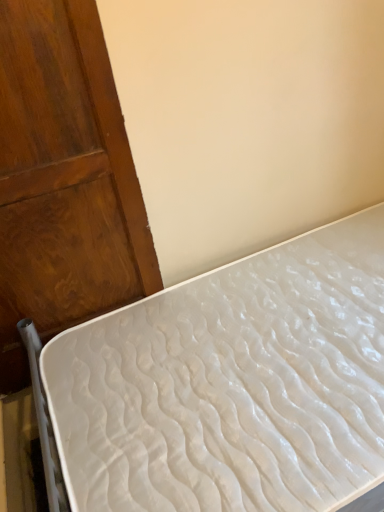
Question: Is wooden door at left wider than white textured mattress at lower right?

Choices:
 (A) no
 (B) yes

Answer: (A)

Question: Is wooden door at left taller than white textured mattress at lower right?

Choices:
 (A) yes
 (B) no

Answer: (A)

Question: From the image's perspective, is wooden door at left located above white textured mattress at lower right?

Choices:
 (A) no
 (B) yes

Answer: (B)

Question: Does wooden door at left touch white textured mattress at lower right?

Choices:
 (A) no
 (B) yes

Answer: (A)

Question: Is the position of wooden door at left less distant than that of white textured mattress at lower right?

Choices:
 (A) yes
 (B) no

Answer: (B)

Question: From a real-world perspective, is wooden door at left positioned over white textured mattress at lower right based on gravity?

Choices:
 (A) no
 (B) yes

Answer: (B)

Question: From a real-world perspective, is white textured mattress at lower right located beneath wooden door at left?

Choices:
 (A) no
 (B) yes

Answer: (B)

Question: Does white textured mattress at lower right have a lesser height compared to wooden door at left?

Choices:
 (A) no
 (B) yes

Answer: (B)

Question: Is white textured mattress at lower right to the left of wooden door at left from the viewer's perspective?

Choices:
 (A) no
 (B) yes

Answer: (A)

Question: Is white textured mattress at lower right closer to the viewer compared to wooden door at left?

Choices:
 (A) yes
 (B) no

Answer: (A)

Question: Is white textured mattress at lower right further to the viewer compared to wooden door at left?

Choices:
 (A) yes
 (B) no

Answer: (B)

Question: From the image's perspective, is white textured mattress at lower right under wooden door at left?

Choices:
 (A) yes
 (B) no

Answer: (A)

Question: Is wooden door at left wider or thinner than white textured mattress at lower right?

Choices:
 (A) wide
 (B) thin

Answer: (B)